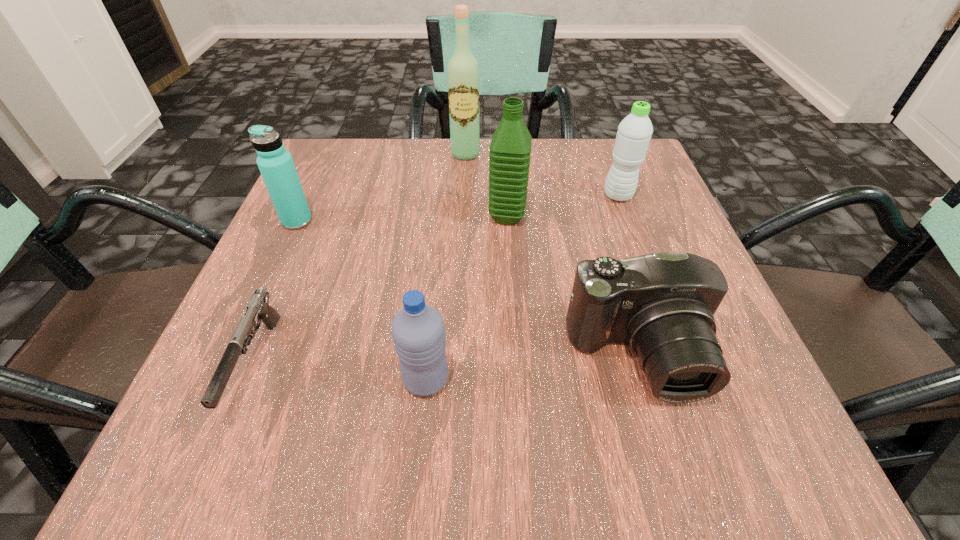
The height and width of the screenshot is (540, 960). In order to click on free space located on the front-facing side of the wine bottle in this screenshot , I will do `click(464, 193)`.

Find the location of a particular element. This screenshot has height=540, width=960. vacant space located 0.360m on the left of the tallest water bottle is located at coordinates (304, 217).

Where is `free space located 0.150m on the back of the farthest water bottle`? free space located 0.150m on the back of the farthest water bottle is located at coordinates (601, 150).

Find the location of a particular element. Image resolution: width=960 pixels, height=540 pixels. vacant space situated 0.130m on the back of the leftmost water bottle is located at coordinates (318, 176).

Find the location of a particular element. free space located on the back of the nearest water bottle is located at coordinates (434, 297).

At what (x,y) coordinates should I click in order to perform the action: click on free space located on the lens of the camera. Please return your answer as a coordinate pair (x, y). This screenshot has height=540, width=960. Looking at the image, I should click on (674, 477).

You are a GUI agent. You are given a task and a screenshot of the screen. Output one action in this format:
    pyautogui.click(x=<x>, y=<y>)
    Task: Click on the wine bottle positioned at the far edge
    This screenshot has width=960, height=540.
    Given the screenshot: What is the action you would take?
    pyautogui.click(x=463, y=71)

Find the location of a particular element. The width and height of the screenshot is (960, 540). water bottle that is positioned at the far edge is located at coordinates point(634,132).

Identify the location of object situated at the near edge. The height and width of the screenshot is (540, 960). (258, 308).

Find the location of `water bottle present at the left edge`. water bottle present at the left edge is located at coordinates (276, 165).